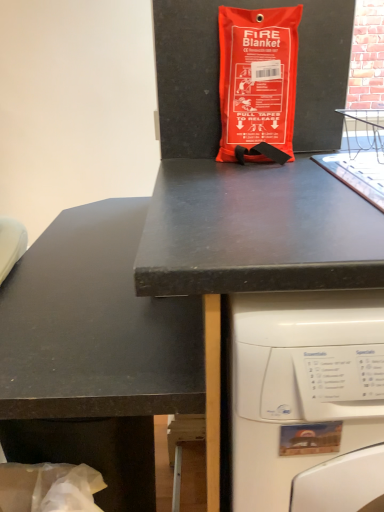
Question: Is black matte desk at upper center behind orange fabric fire blanket at center?

Choices:
 (A) yes
 (B) no

Answer: (B)

Question: From a real-world perspective, is black matte desk at upper center on orange fabric fire blanket at center?

Choices:
 (A) yes
 (B) no

Answer: (B)

Question: Is black matte desk at upper center facing towards orange fabric fire blanket at center?

Choices:
 (A) no
 (B) yes

Answer: (A)

Question: Does black matte desk at upper center have a larger size compared to orange fabric fire blanket at center?

Choices:
 (A) yes
 (B) no

Answer: (A)

Question: Is black matte desk at upper center not close to orange fabric fire blanket at center?

Choices:
 (A) no
 (B) yes

Answer: (A)

Question: From the image's perspective, would you say black matte desk at upper center is shown under orange fabric fire blanket at center?

Choices:
 (A) yes
 (B) no

Answer: (A)

Question: Does orange fabric fire blanket at center touch black matte desk at upper center?

Choices:
 (A) yes
 (B) no

Answer: (B)

Question: From the image's perspective, would you say orange fabric fire blanket at center is positioned over black matte desk at upper center?

Choices:
 (A) yes
 (B) no

Answer: (A)

Question: Is orange fabric fire blanket at center located outside black matte desk at upper center?

Choices:
 (A) yes
 (B) no

Answer: (A)

Question: Is orange fabric fire blanket at center smaller than black matte desk at upper center?

Choices:
 (A) yes
 (B) no

Answer: (A)

Question: Is black matte desk at upper center surrounded by orange fabric fire blanket at center?

Choices:
 (A) no
 (B) yes

Answer: (A)

Question: From a real-world perspective, is orange fabric fire blanket at center over black matte desk at upper center?

Choices:
 (A) no
 (B) yes

Answer: (B)

Question: Does black matte counter top at center appear on the right side of black matte desk at upper center?

Choices:
 (A) no
 (B) yes

Answer: (A)